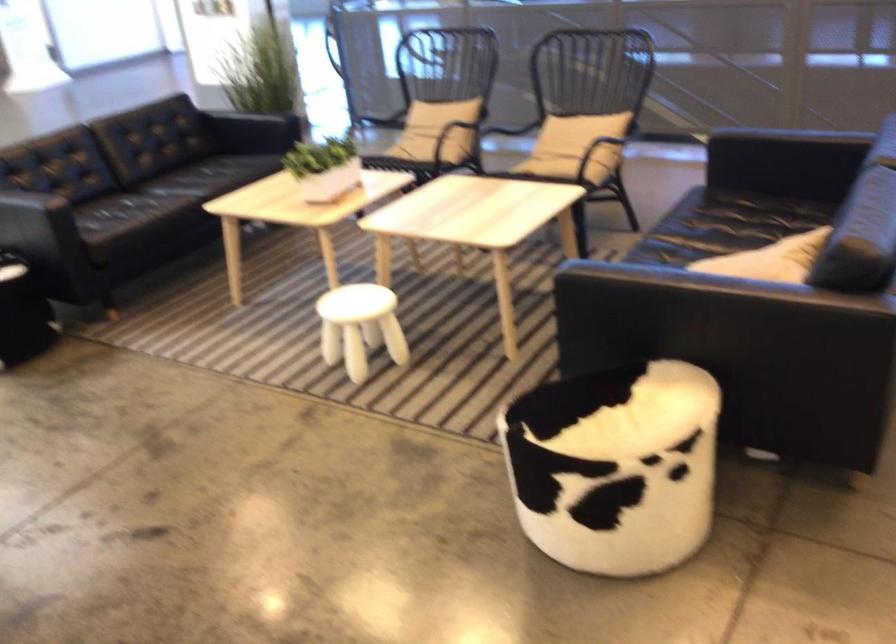
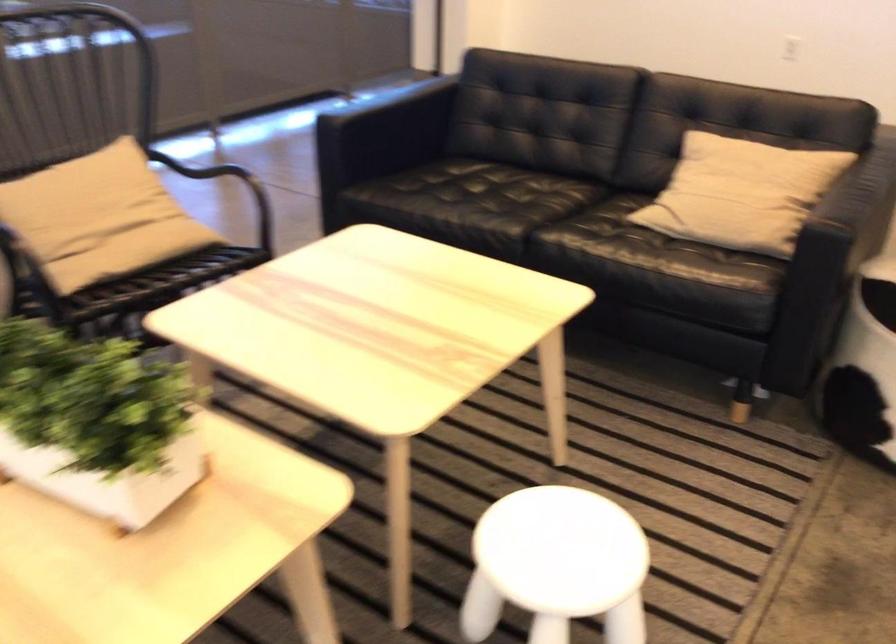
Locate, in the second image, the point that corresponds to point (298, 162) in the first image.

(96, 422)